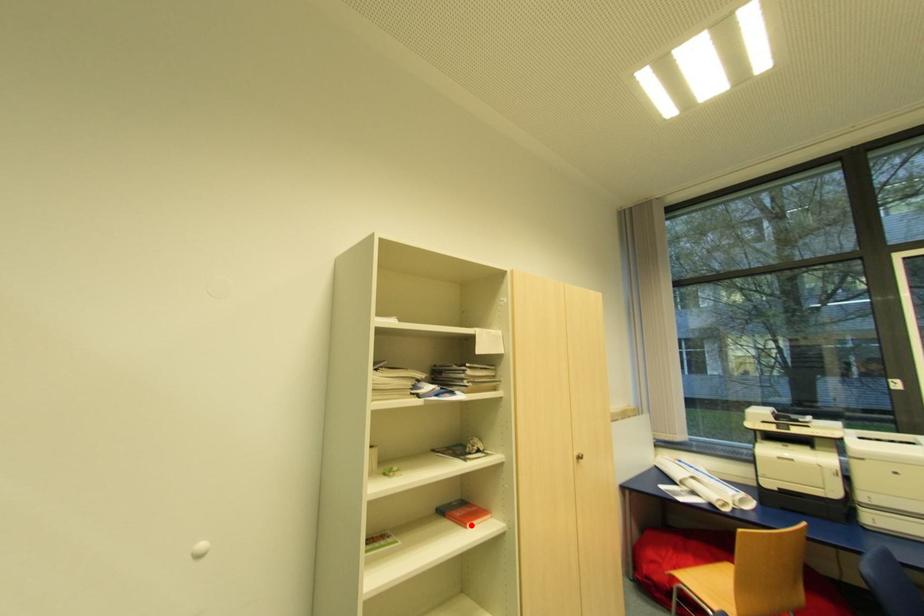
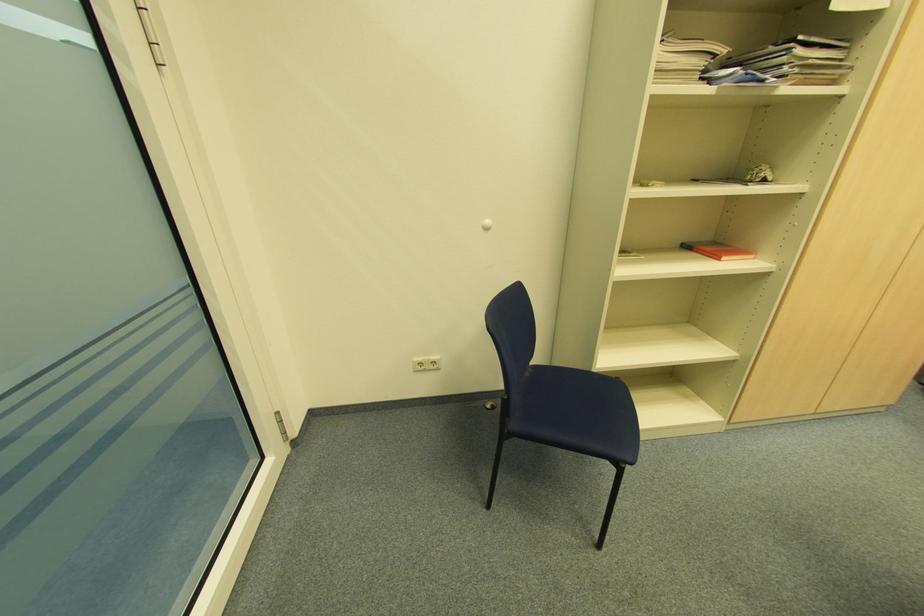
Locate, in the second image, the point that corresponds to the highlighted location in the first image.

(726, 257)